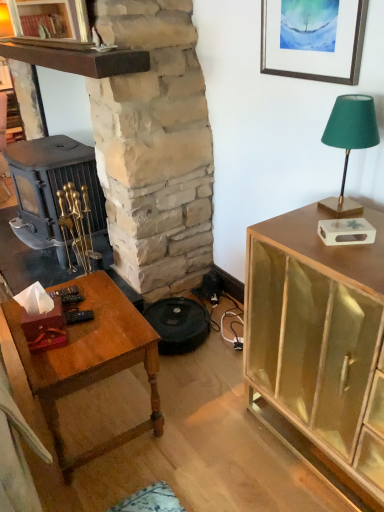
Question: Does green fabric lampshade at upper right have a lesser height compared to matte gold cabinet at right?

Choices:
 (A) yes
 (B) no

Answer: (A)

Question: From a real-world perspective, is green fabric lampshade at upper right physically above matte gold cabinet at right?

Choices:
 (A) no
 (B) yes

Answer: (B)

Question: From the image's perspective, does green fabric lampshade at upper right appear lower than matte gold cabinet at right?

Choices:
 (A) no
 (B) yes

Answer: (A)

Question: Could you tell me if green fabric lampshade at upper right is facing matte gold cabinet at right?

Choices:
 (A) yes
 (B) no

Answer: (B)

Question: Can you confirm if green fabric lampshade at upper right is bigger than matte gold cabinet at right?

Choices:
 (A) yes
 (B) no

Answer: (B)

Question: From a real-world perspective, does green fabric lampshade at upper right sit lower than matte gold cabinet at right?

Choices:
 (A) no
 (B) yes

Answer: (A)

Question: Is green fabric lampshade at upper right to the left of wooden table at lower left from the viewer's perspective?

Choices:
 (A) no
 (B) yes

Answer: (A)

Question: Is green fabric lampshade at upper right located outside wooden table at lower left?

Choices:
 (A) no
 (B) yes

Answer: (B)

Question: Does green fabric lampshade at upper right come behind wooden table at lower left?

Choices:
 (A) no
 (B) yes

Answer: (A)

Question: From the image's perspective, would you say green fabric lampshade at upper right is shown under wooden table at lower left?

Choices:
 (A) no
 (B) yes

Answer: (A)

Question: From the image's perspective, is green fabric lampshade at upper right located above wooden table at lower left?

Choices:
 (A) yes
 (B) no

Answer: (A)

Question: From a real-world perspective, does green fabric lampshade at upper right stand above wooden table at lower left?

Choices:
 (A) yes
 (B) no

Answer: (A)

Question: Does stone fireplace at center touch wooden table at lower left?

Choices:
 (A) yes
 (B) no

Answer: (B)